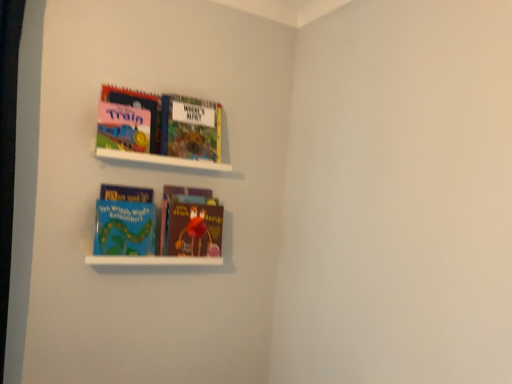
I want to click on blank space above white matte bookshelf at upper center, the first cabinet from the top (from a real-world perspective), so click(159, 148).